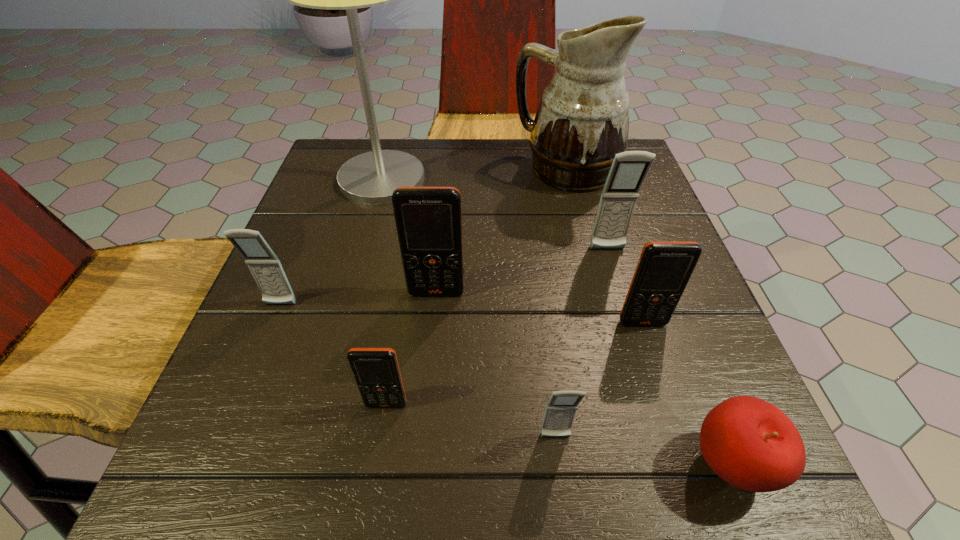
Locate an element on the screen. The width and height of the screenshot is (960, 540). the tallest object is located at coordinates (371, 178).

Where is `brown pitcher`? brown pitcher is located at coordinates (x=582, y=122).

This screenshot has height=540, width=960. I want to click on pitcher, so click(x=582, y=122).

Locate an element on the screen. This screenshot has height=540, width=960. the farthest gray cellular telephone is located at coordinates (629, 169).

The height and width of the screenshot is (540, 960). In order to click on the biggest gray cellular telephone in this screenshot , I will do `click(629, 169)`.

At what (x,y) coordinates should I click in order to perform the action: click on the fifth nearest cellular telephone. Please return your answer as a coordinate pair (x, y). The image size is (960, 540). Looking at the image, I should click on (428, 219).

Image resolution: width=960 pixels, height=540 pixels. Find the location of `the sixth nearest object`. the sixth nearest object is located at coordinates (428, 219).

Find the location of a particular element. The width and height of the screenshot is (960, 540). the leftmost gray cellular telephone is located at coordinates (264, 265).

At what (x,y) coordinates should I click in order to perform the action: click on the leftmost cellular telephone. Please return your answer as a coordinate pair (x, y). The height and width of the screenshot is (540, 960). Looking at the image, I should click on (x=264, y=265).

Where is `the third nearest cellular telephone`? The image size is (960, 540). the third nearest cellular telephone is located at coordinates (664, 268).